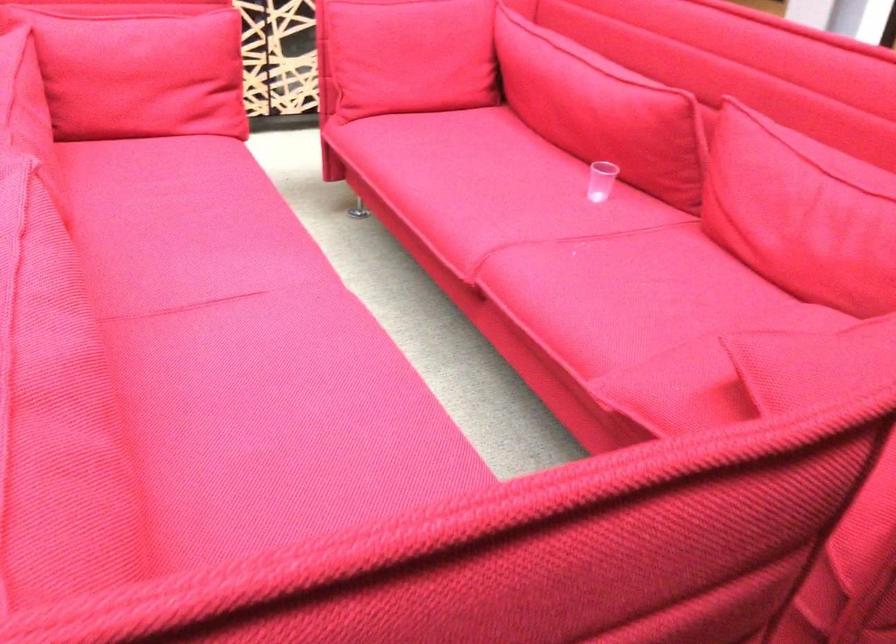
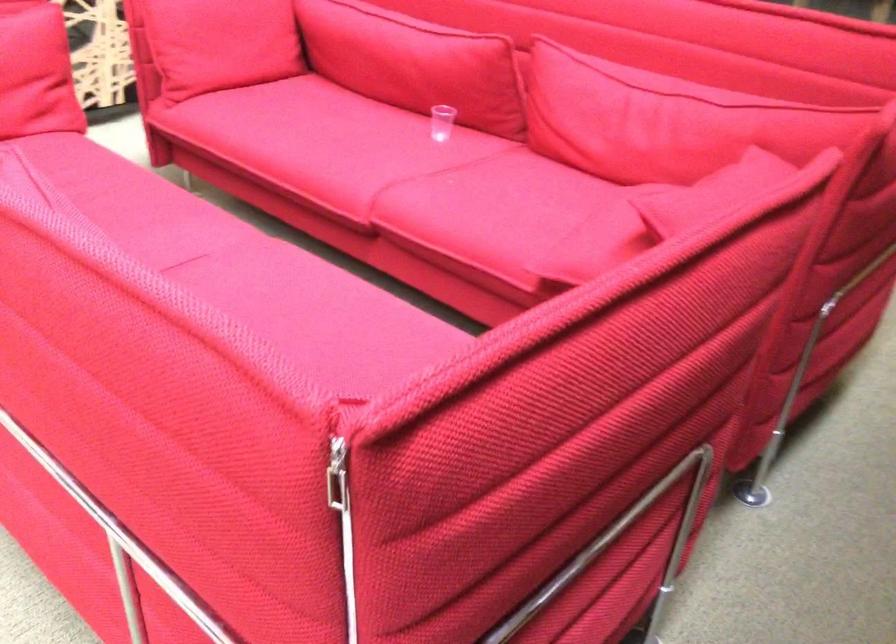
The point at (458, 189) is marked in the first image. Where is the corresponding point in the second image?

(320, 146)